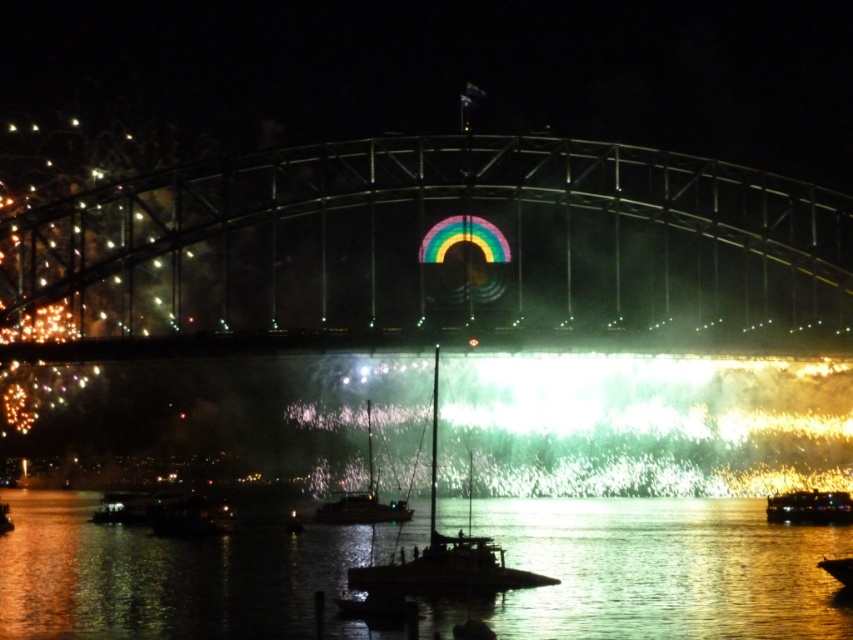
In the scene shown: You are a photographer trying to capture both the shiny metallic sailboat at center and the metallic silver boat at lower right in the same frame. Based on their positions, which boat should you adjust your camera to focus on first to ensure both are in the shot?

The shiny metallic sailboat at center is positioned on the left side of metallic silver boat at lower right, so you should focus on the metallic silver boat at lower right first to ensure both boats are included in the frame.

Based on the coordinates provided, where is the glistening water at center located in the image?

The glistening water at center is located at the point with coordinates 0.891 in the x axis and 0.778 in the y axis.